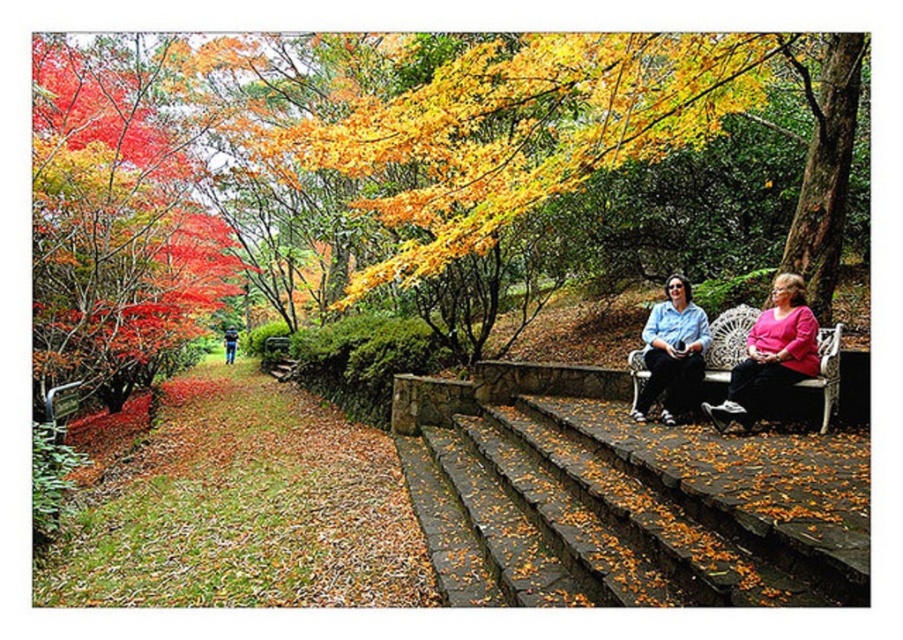
This screenshot has width=903, height=640. Describe the element at coordinates (764, 353) in the screenshot. I see `matte pink blouse at center` at that location.

Who is positioned more to the right, matte pink blouse at center or matte blue shirt at center?

matte pink blouse at center is more to the right.

Locate an element on the screen. matte pink blouse at center is located at coordinates (764, 353).

Can you confirm if stone steps at center is positioned to the right of matte blue shirt at center?

Incorrect, stone steps at center is not on the right side of matte blue shirt at center.

Is stone steps at center positioned behind matte blue shirt at center?

No, stone steps at center is in front of matte blue shirt at center.

Is point (812, 467) positioned before point (691, 369)?

Yes, it is.

The image size is (903, 640). What are the coordinates of `stone steps at center` in the screenshot? It's located at tap(669, 508).

Is stone steps at center to the right of blue jeans at lower left from the viewer's perspective?

Correct, you'll find stone steps at center to the right of blue jeans at lower left.

Does stone steps at center appear on the left side of blue jeans at lower left?

Incorrect, stone steps at center is not on the left side of blue jeans at lower left.

I want to click on stone steps at center, so click(669, 508).